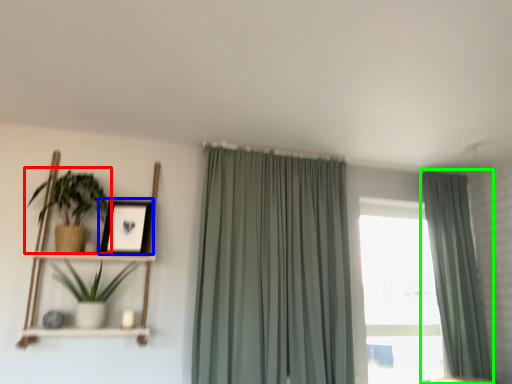
Question: Considering the real-world distances, which object is closest to houseplant (highlighted by a red box)? picture frame (highlighted by a blue box) or curtain (highlighted by a green box).

Choices:
 (A) picture frame
 (B) curtain

Answer: (A)